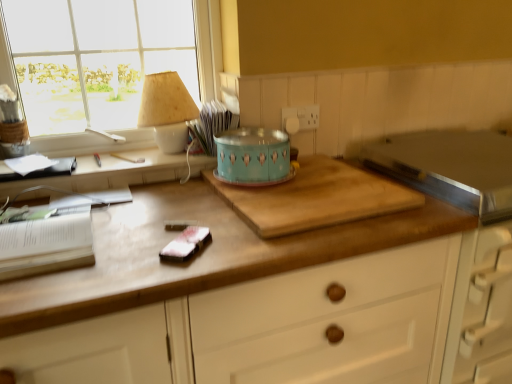
Question: Is point (352, 256) positioned closer to the camera than point (108, 29)?

Choices:
 (A) closer
 (B) farther

Answer: (A)

Question: From their relative heights in the image, would you say wooden cutting board at center is taller or shorter than clear glass window at upper left?

Choices:
 (A) short
 (B) tall

Answer: (B)

Question: Which object is positioned closest to the white paper book at left?

Choices:
 (A) clear glass window at upper left
 (B) teal glossy cake tin at center, the first appliance positioned from the left
 (C) wooden desk at lower left
 (D) matte beige lampshade at upper left
 (E) wooden cutting board at center

Answer: (C)

Question: Which of these objects is positioned closest to the matte beige lampshade at upper left?

Choices:
 (A) clear glass window at upper left
 (B) stainless steel toaster at upper right, the 1th appliance from the right
 (C) satin pink fabric at center
 (D) wooden cutting board at center
 (E) white paper book at left

Answer: (A)